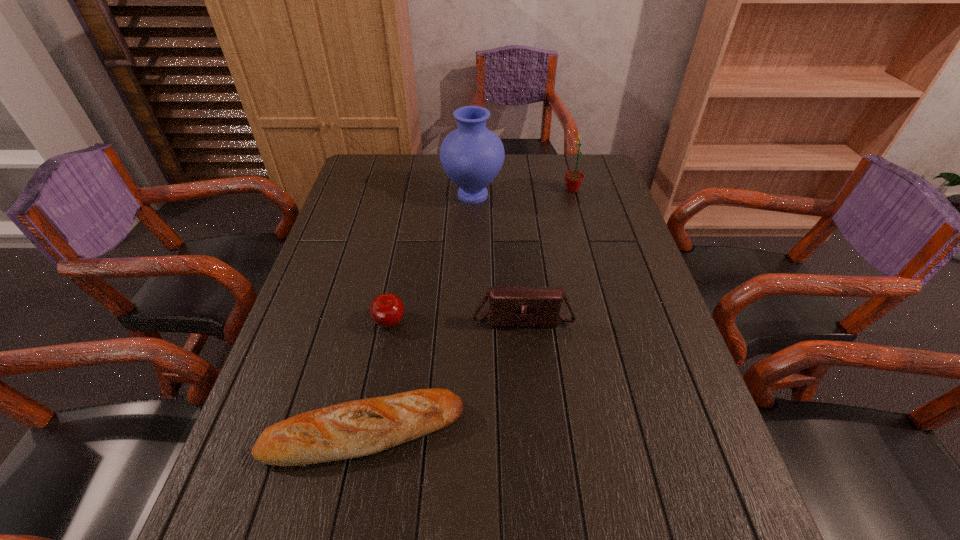
The height and width of the screenshot is (540, 960). In order to click on free point between the rightmost object and the baguet in this screenshot , I will do `click(468, 310)`.

Where is `free point between the tallest object and the baguet`? The height and width of the screenshot is (540, 960). free point between the tallest object and the baguet is located at coordinates (419, 314).

Where is `vacant region between the vase and the fourth shortest object`? vacant region between the vase and the fourth shortest object is located at coordinates click(x=522, y=193).

This screenshot has width=960, height=540. What are the coordinates of `object that stands as the closest to the vase` in the screenshot? It's located at tap(573, 179).

The height and width of the screenshot is (540, 960). I want to click on object that ranks as the second closest to the baguet, so click(536, 307).

Image resolution: width=960 pixels, height=540 pixels. What are the coordinates of `free space that satisfies the following two spatial constraints: 1. on the back side of the vase; 2. on the left side of the second shortest object` in the screenshot? It's located at (414, 195).

The image size is (960, 540). In order to click on free space that satisfies the following two spatial constraints: 1. on the face of the sunflower; 2. on the front side of the shortest object in this screenshot , I will do `click(637, 431)`.

Locate an element on the screen. The width and height of the screenshot is (960, 540). free space that satisfies the following two spatial constraints: 1. on the face of the rightmost object; 2. on the front side of the fourth tallest object is located at coordinates (609, 325).

The image size is (960, 540). What are the coordinates of `vacant space that satisfies the following two spatial constraints: 1. on the face of the rightmost object; 2. on the front flap of the shoulder bag` in the screenshot? It's located at (607, 318).